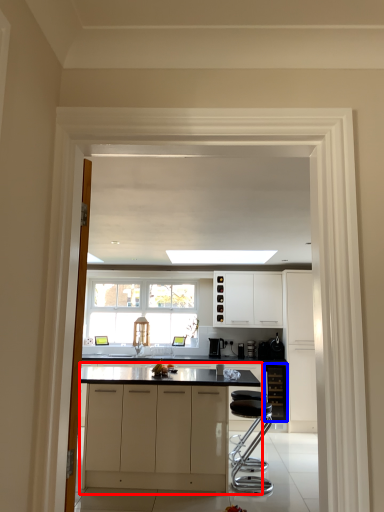
Question: Among these objects, which one is nearest to the camera, cabinetry (highlighted by a red box) or cabinetry (highlighted by a blue box)?

Choices:
 (A) cabinetry
 (B) cabinetry

Answer: (A)